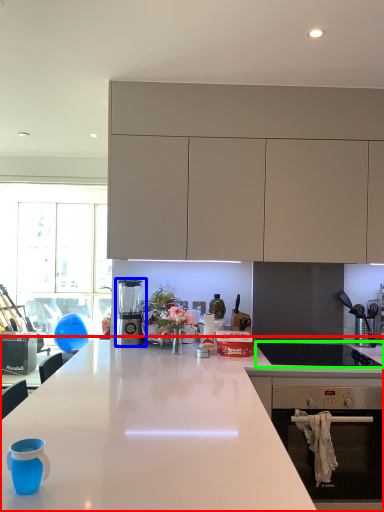
Question: Which object is positioned farthest from countertop (highlighted by a red box)? Select from kitchen appliance (highlighted by a blue box) and gas stove (highlighted by a green box).

Choices:
 (A) kitchen appliance
 (B) gas stove

Answer: (A)